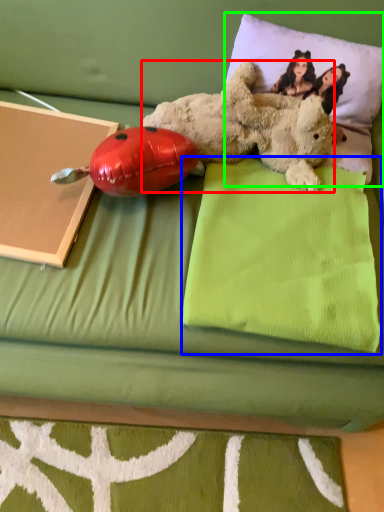
Question: Based on their relative distances, which object is farther from teddy bear (highlighted by a red box)? Choose from pillow (highlighted by a blue box) and pillow (highlighted by a green box).

Choices:
 (A) pillow
 (B) pillow

Answer: (A)